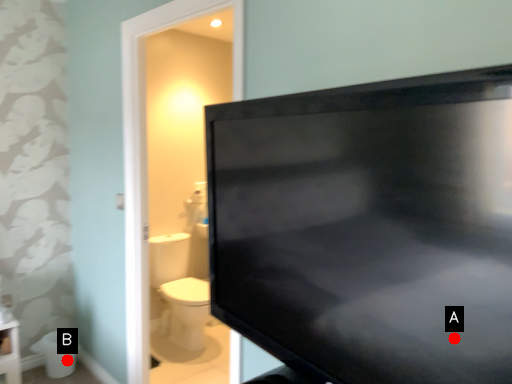
Question: Two points are circled on the image, labeled by A and B beside each circle. Which point appears closest to the camera in this image?

Choices:
 (A) A is closer
 (B) B is closer

Answer: (A)